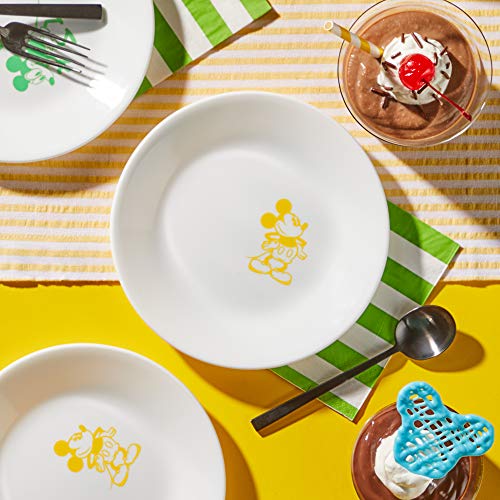
Locate an element on the screen. The image size is (500, 500). green and white napkin is located at coordinates (385, 320).